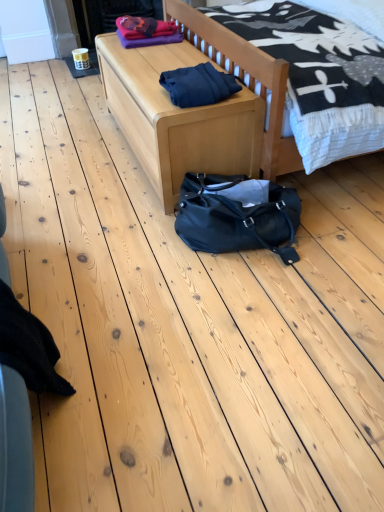
Question: Is light wood bench at center positioned with its back to dark blue fabric at center?

Choices:
 (A) yes
 (B) no

Answer: (B)

Question: Is light wood bench at center positioned behind dark blue fabric at center?

Choices:
 (A) no
 (B) yes

Answer: (B)

Question: From a real-world perspective, is light wood bench at center located beneath dark blue fabric at center?

Choices:
 (A) no
 (B) yes

Answer: (B)

Question: Does light wood bench at center have a larger size compared to dark blue fabric at center?

Choices:
 (A) no
 (B) yes

Answer: (B)

Question: Is light wood bench at center next to dark blue fabric at center?

Choices:
 (A) yes
 (B) no

Answer: (B)

Question: Is light wood bench at center not close to dark blue fabric at center?

Choices:
 (A) yes
 (B) no

Answer: (B)

Question: Does light wood bed at center have a smaller size compared to black fabric at lower left?

Choices:
 (A) yes
 (B) no

Answer: (B)

Question: Does light wood bed at center lie behind black fabric at lower left?

Choices:
 (A) yes
 (B) no

Answer: (A)

Question: Is light wood bed at center facing away from black fabric at lower left?

Choices:
 (A) yes
 (B) no

Answer: (B)

Question: Is light wood bed at center placed right next to black fabric at lower left?

Choices:
 (A) no
 (B) yes

Answer: (A)

Question: From the image's perspective, is light wood bed at center below black fabric at lower left?

Choices:
 (A) yes
 (B) no

Answer: (B)

Question: Does light wood bed at center have a greater height compared to black fabric at lower left?

Choices:
 (A) no
 (B) yes

Answer: (B)

Question: Considering the relative sizes of light wood bed at center and light wood bench at center in the image provided, is light wood bed at center bigger than light wood bench at center?

Choices:
 (A) no
 (B) yes

Answer: (B)